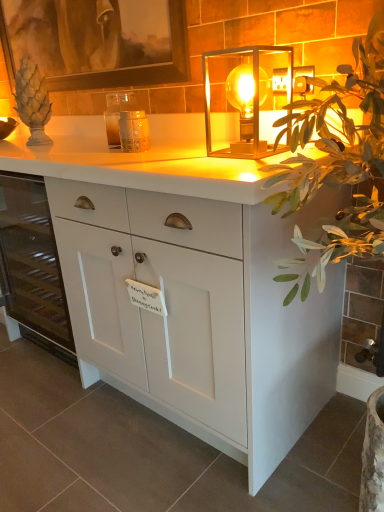
Question: From a real-world perspective, relative to translucent glass cube at center, is translucent glass candle holder at center vertically above or below?

Choices:
 (A) below
 (B) above

Answer: (A)

Question: In the image, is translucent glass candle holder at center on the left side or the right side of translucent glass cube at center?

Choices:
 (A) right
 (B) left

Answer: (B)

Question: Estimate the real-world distances between objects in this image. Which object is closer to the white matte cabinet at left?

Choices:
 (A) translucent glass cube at center
 (B) white matte cabinet at center
 (C) translucent glass candle holder at center
 (D) wooden picture frame at upper left

Answer: (B)

Question: Based on their relative distances, which object is nearer to the translucent glass cube at center?

Choices:
 (A) white matte cabinet at left
 (B) translucent glass candle holder at center
 (C) white matte cabinet at center
 (D) wooden picture frame at upper left

Answer: (B)